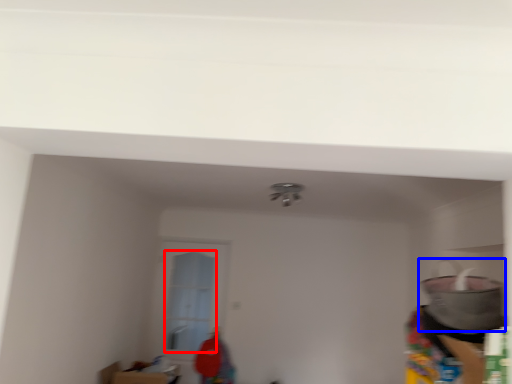
Question: Which object appears closest to the camera in this image, glass door (highlighted by a red box) or appliance (highlighted by a blue box)?

Choices:
 (A) glass door
 (B) appliance

Answer: (B)